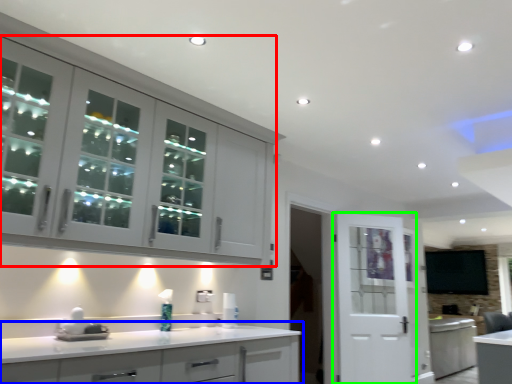
Question: Considering the real-world distances, which object is closest to cabinetry (highlighted by a red box)? cabinetry (highlighted by a blue box) or door (highlighted by a green box).

Choices:
 (A) cabinetry
 (B) door

Answer: (A)